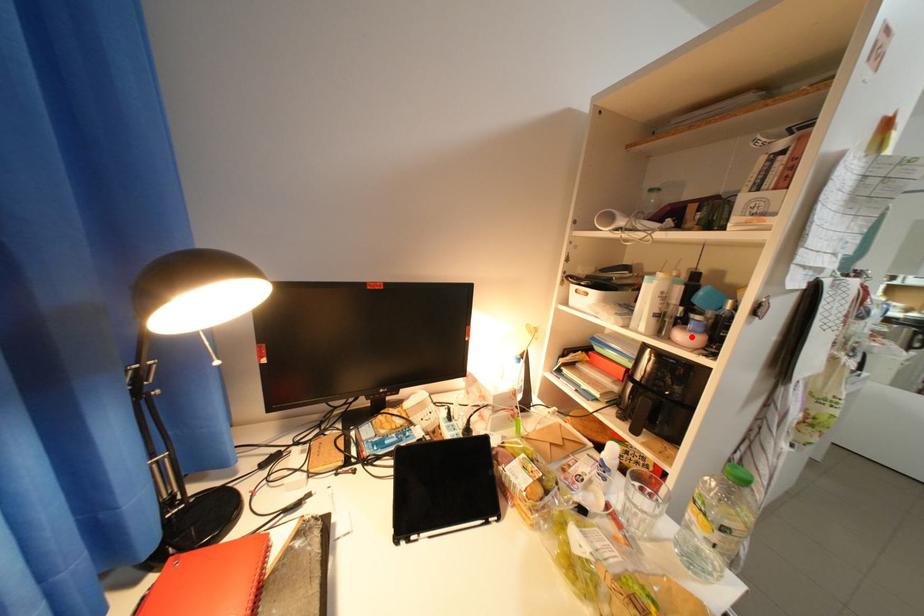
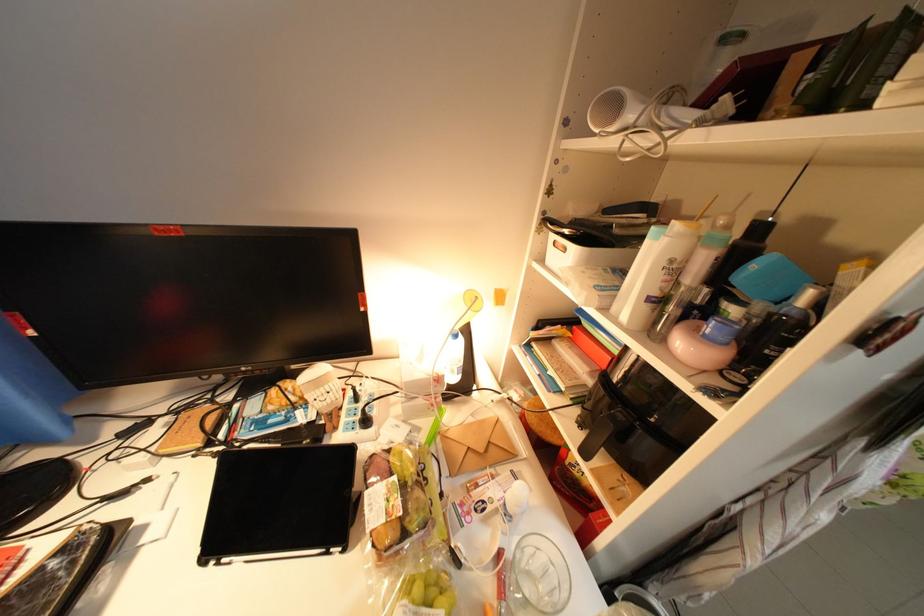
In the second image, find the point that corresponds to the highlighted location in the first image.

(693, 344)